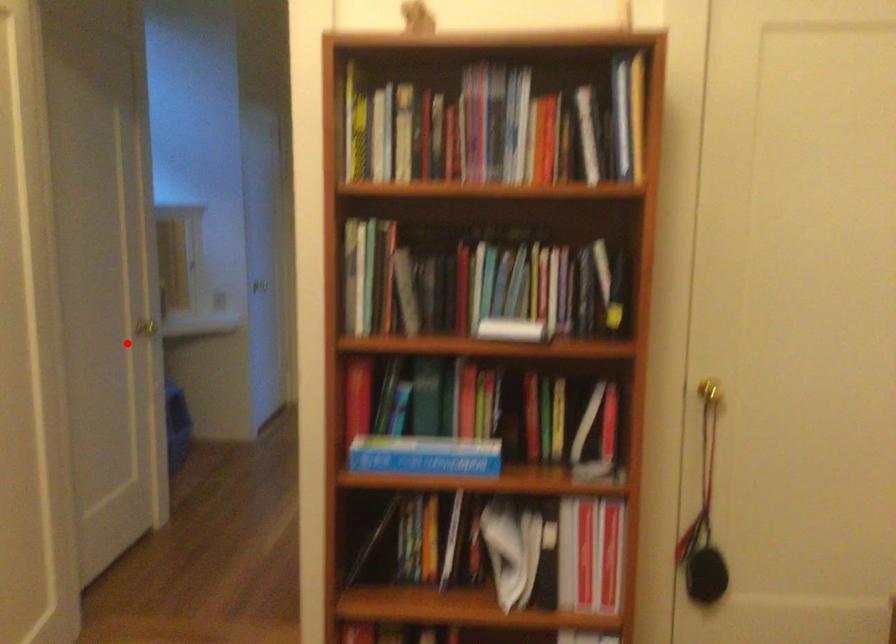
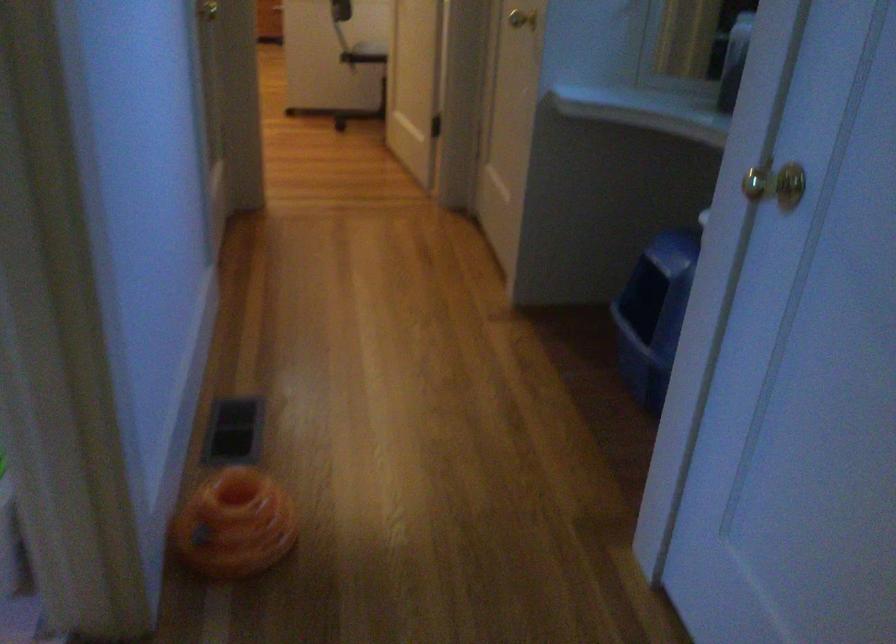
Question: I am providing you with two images of the same scene from different viewpoints. Image1 has a red point marked. In image2, the corresponding 3D location appears at what relative position? Reply with the corresponding letter.

Choices:
 (A) Closer
 (B) Farther

Answer: (A)